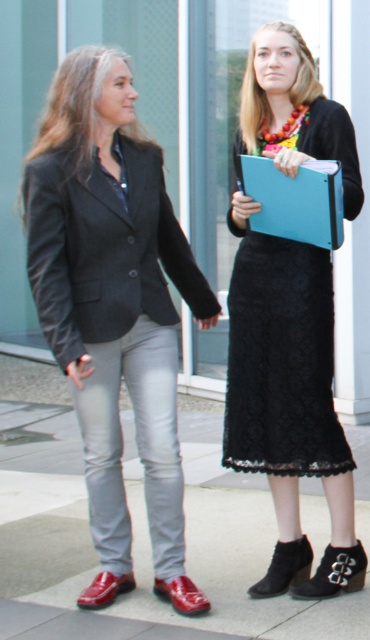
Who is more forward, [166,518] or [19,552]?

Point [166,518] is in front.

Does point (149, 465) lie in front of point (62, 442)?

Yes, it is.

This screenshot has width=370, height=640. Describe the element at coordinates (113, 307) in the screenshot. I see `matte black blazer at left` at that location.

This screenshot has width=370, height=640. What are the coordinates of `matte black blazer at left` in the screenshot? It's located at (113, 307).

The image size is (370, 640). Describe the element at coordinates (113, 307) in the screenshot. I see `matte black blazer at left` at that location.

Between point (125, 218) and point (270, 163), which one is positioned in front?

Point (270, 163)

You are a GUI agent. You are given a task and a screenshot of the screen. Output one action in this format:
    pyautogui.click(x=<x>, y=<y>)
    Task: Click on the matte black blazer at left
    The height and width of the screenshot is (640, 370).
    Given the screenshot: What is the action you would take?
    pyautogui.click(x=113, y=307)

Is black lace skirt at center to the left of blue matte clipboard at center from the viewer's perspective?

Incorrect, black lace skirt at center is not on the left side of blue matte clipboard at center.

Is the position of black lace skirt at center more distant than that of blue matte clipboard at center?

Yes, black lace skirt at center is behind blue matte clipboard at center.

Which is behind, point (250, 595) or point (298, 202)?

Positioned behind is point (250, 595).

At what (x,y) coordinates should I click in order to perform the action: click on black lace skirt at center. Please return your answer as a coordinate pair (x, y). Looking at the image, I should click on (288, 401).